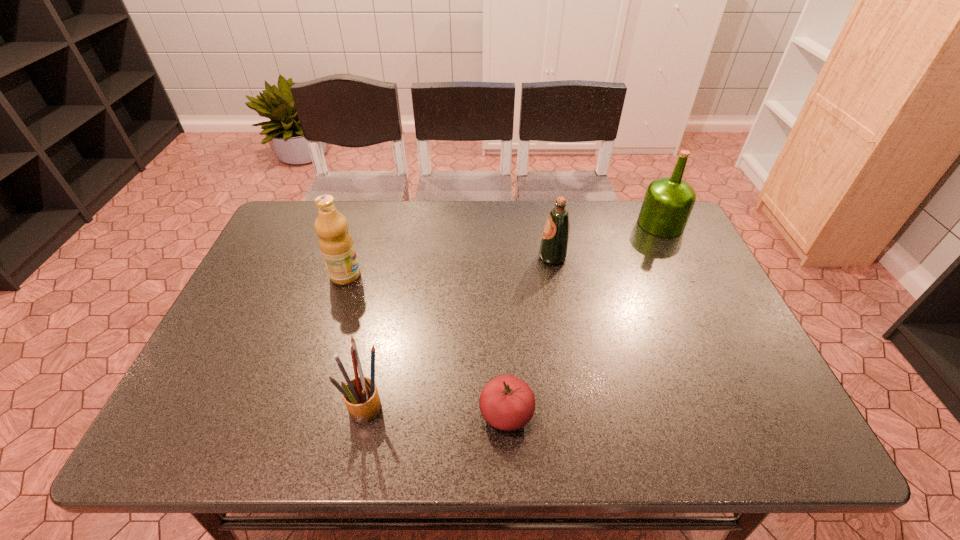
Locate an element on the screen. The width and height of the screenshot is (960, 540). object that is at the far right corner is located at coordinates (668, 201).

In the image, there is a desktop. Where is `vacant space at the far edge`? The width and height of the screenshot is (960, 540). vacant space at the far edge is located at coordinates (354, 226).

In the image, there is a desktop. Where is `vacant space at the left edge`? The image size is (960, 540). vacant space at the left edge is located at coordinates (269, 298).

At what (x,y) coordinates should I click in order to perform the action: click on vacant space at the right edge of the desktop. Please return your answer as a coordinate pair (x, y). Looking at the image, I should click on (686, 303).

Find the location of a particular element. vacant space at the near left corner of the desktop is located at coordinates (228, 434).

I want to click on free space at the near right corner of the desktop, so click(781, 433).

Image resolution: width=960 pixels, height=540 pixels. Find the location of `unoccupied area between the fourth object from left to right and the leftmost object`. unoccupied area between the fourth object from left to right and the leftmost object is located at coordinates (449, 266).

Identify the location of free space between the tomato and the rightmost object. (584, 319).

I want to click on empty location between the farthest object and the leftmost object, so click(503, 249).

I want to click on vacant area that lies between the third object from right to left and the leftmost olive oil, so click(426, 345).